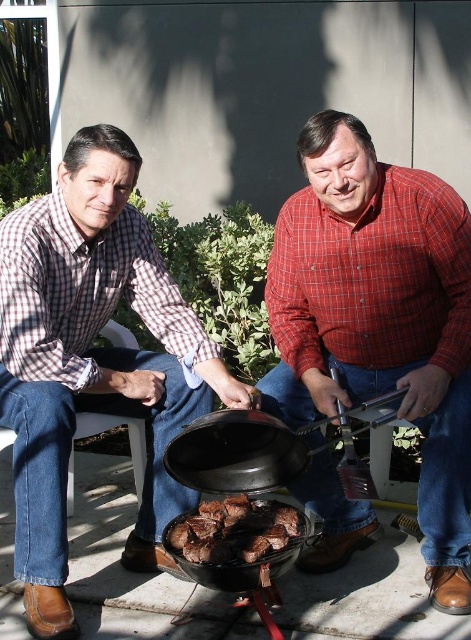
Question: Which point is closer to the camera?

Choices:
 (A) red checkered shirt at center
 (B) plaid shirt at left
 (C) brown matte/charred meat at center

Answer: (C)

Question: Among these points, which one is nearest to the camera?

Choices:
 (A) (196, 540)
 (B) (438, 374)
 (C) (11, 408)

Answer: (A)

Question: Does red checkered shirt at center have a lesser width compared to brown matte/charred meat at center?

Choices:
 (A) yes
 (B) no

Answer: (B)

Question: Is plaid shirt at left above brown matte/charred meat at center?

Choices:
 (A) no
 (B) yes

Answer: (B)

Question: Does plaid shirt at left have a smaller size compared to brown matte/charred meat at center?

Choices:
 (A) yes
 (B) no

Answer: (B)

Question: Which point is farther to the camera?

Choices:
 (A) (347, 195)
 (B) (178, 541)

Answer: (A)